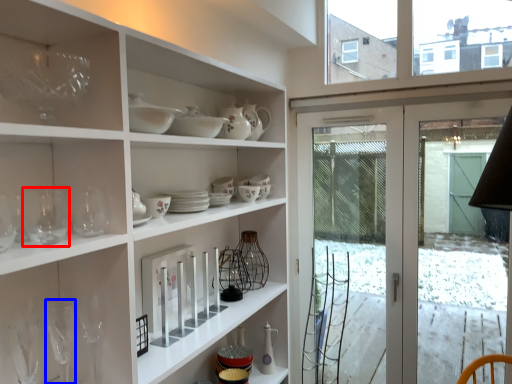
Question: Which object is closer to the camera taking this photo, wine glass (highlighted by a red box) or wine glass (highlighted by a blue box)?

Choices:
 (A) wine glass
 (B) wine glass

Answer: (A)